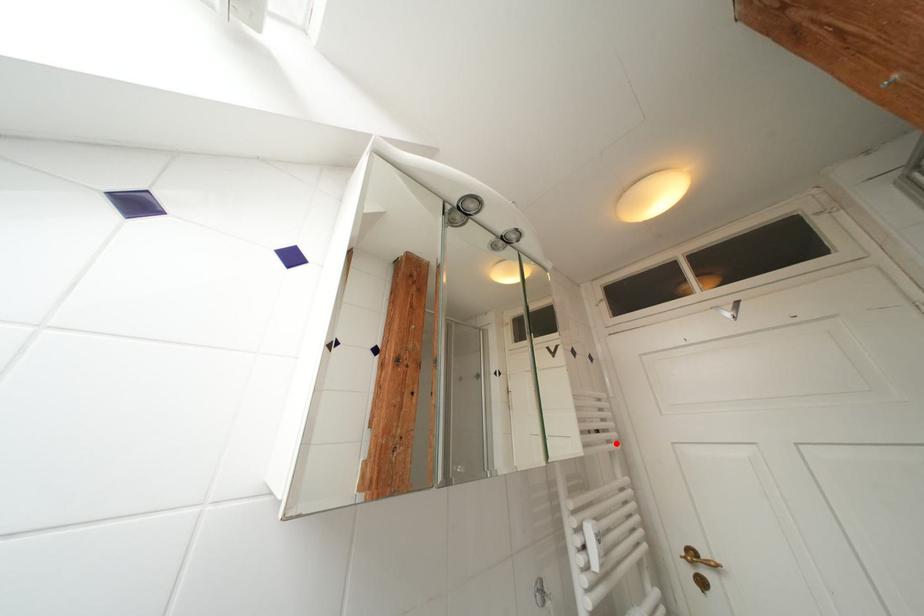
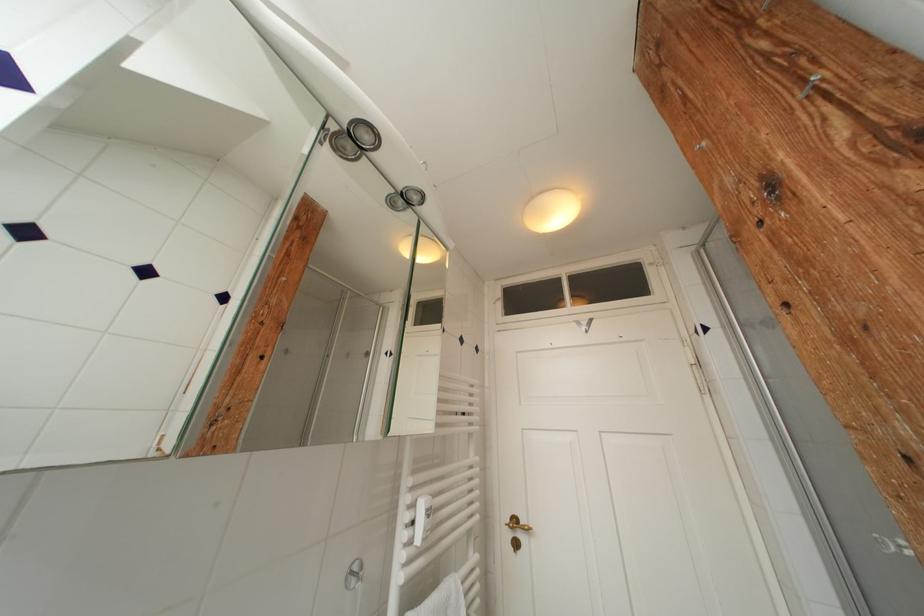
In the second image, find the point that corresponds to the highlighted location in the first image.

(478, 427)